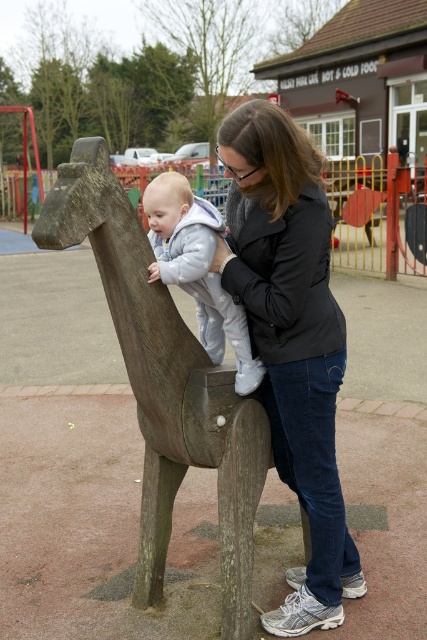
You are a photographer trying to capture a candid shot of the matte black jacket at center and the light gray fleece onesie at center. Your camera has a depth of field that can focus on objects within 40 centimeters of each other. Can you capture both subjects in focus in a single shot?

Yes, the distance between the matte black jacket at center and the light gray fleece onesie at center is 39.98 centimeters, which is within the 40 centimeter range. Therefore, both subjects can be captured in focus in a single shot.

You are a photographer setting up a shot of the woman and baby near the wooden horse. You need to ensure both the matte black jacket at center and the light gray fleece onesie at center are fully visible in the frame. Given their sizes, which clothing item requires a wider shot to capture its full width?

The matte black jacket at center has a greater width than the light gray fleece onesie at center, so the matte black jacket at center requires a wider shot to fully capture its width.